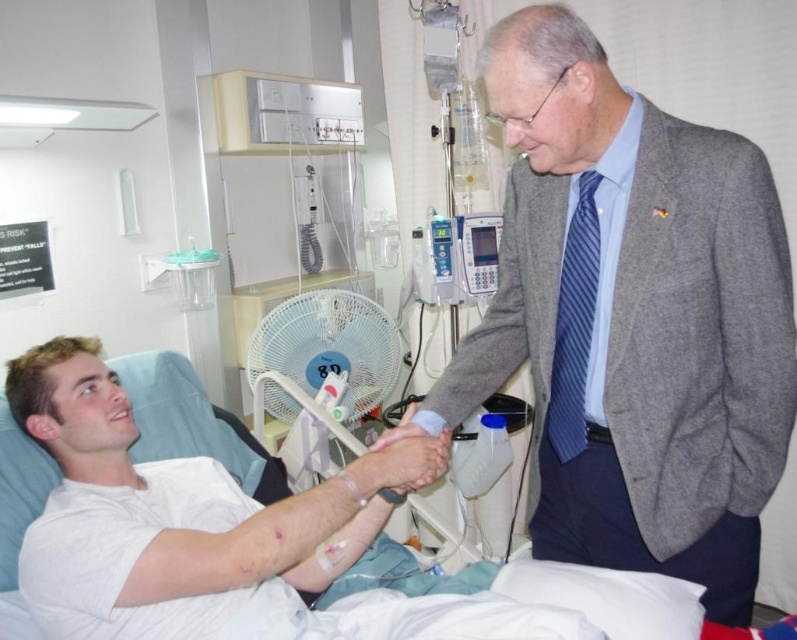
Is gray woolen suit at center wider than smooth skin hand at center?

Correct, the width of gray woolen suit at center exceeds that of smooth skin hand at center.

Which is above, gray woolen suit at center or smooth skin hand at center?

gray woolen suit at center

Is point (771, 198) positioned in front of point (423, 433)?

Yes, it is.

Identify the location of gray woolen suit at center. The width and height of the screenshot is (797, 640). (631, 317).

Who is more forward, [207,465] or [393,442]?

Point [393,442]

Is point (77, 547) positioned in front of point (413, 428)?

Yes, it is in front of point (413, 428).

Who is more distant from viewer, (63,397) or (415,435)?

Positioned behind is point (63,397).

Find the location of a particular element. white fabric hospital bed at center is located at coordinates (261, 541).

Can you confirm if gray woolen suit at center is positioned to the left of white fabric hospital bed at center?

In fact, gray woolen suit at center is to the right of white fabric hospital bed at center.

Can you confirm if gray woolen suit at center is smaller than white fabric hospital bed at center?

Yes, gray woolen suit at center is smaller than white fabric hospital bed at center.

Is point (532, 337) less distant than point (517, 602)?

That is False.

Find the location of `gray woolen suit at center`. gray woolen suit at center is located at coordinates (631, 317).